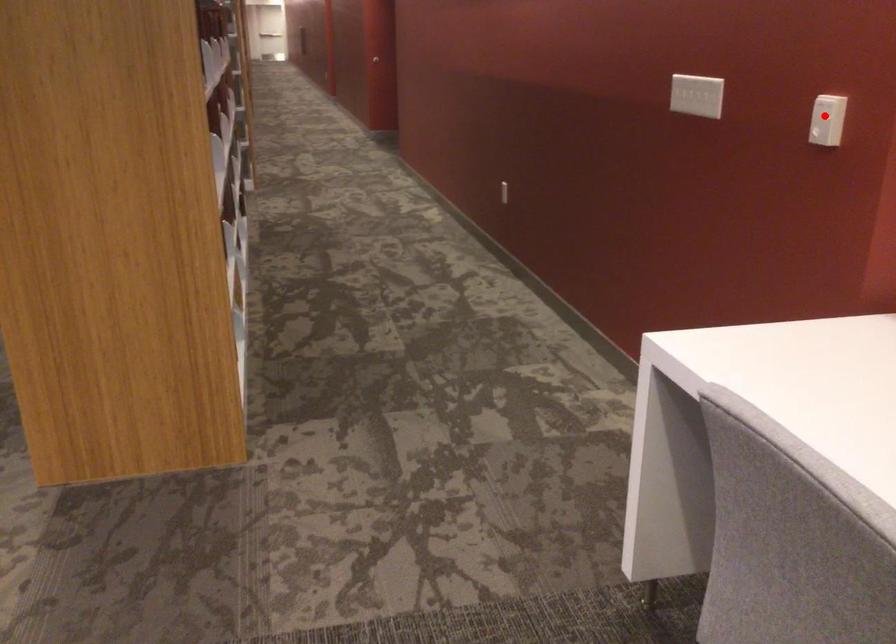
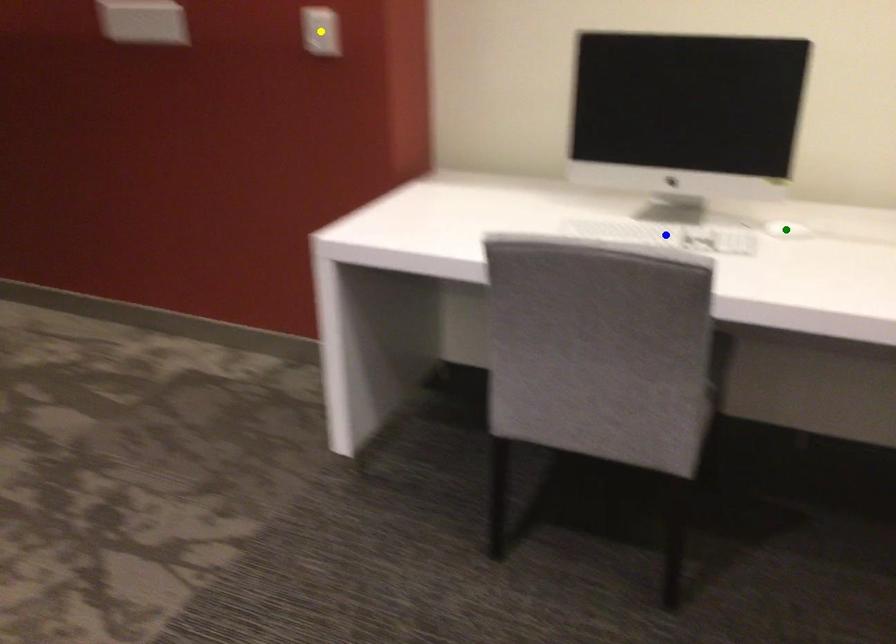
Question: I am providing you with two images of the same scene from different viewpoints. A red point is marked on the first image. You are given multiple points on the second image. Which point in image 2 represents the same 3d spot as the red point in image 1?

Choices:
 (A) yellow point
 (B) green point
 (C) blue point

Answer: (A)